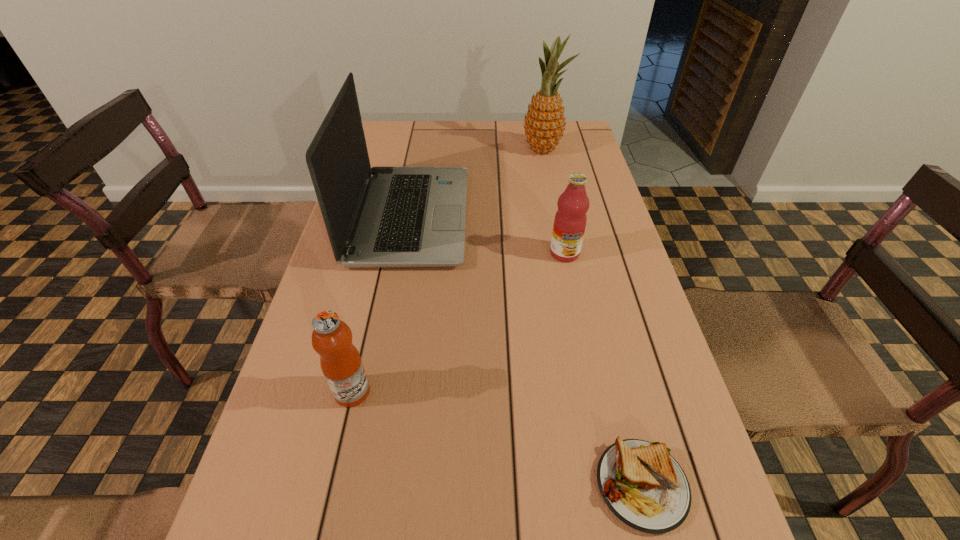
What are the coordinates of `free location at the left edge of the desktop` in the screenshot? It's located at (362, 291).

The width and height of the screenshot is (960, 540). Find the location of `free space at the right edge`. free space at the right edge is located at coordinates (587, 159).

At what (x,y) coordinates should I click in order to perform the action: click on vacant space at the far left corner. Please return your answer as a coordinate pair (x, y). Looking at the image, I should click on (419, 142).

Where is `vacant space at the far right corner of the desktop`? vacant space at the far right corner of the desktop is located at coordinates (579, 143).

Find the location of `empty location between the nearer fruit juice and the shortest object`. empty location between the nearer fruit juice and the shortest object is located at coordinates (497, 438).

Where is `vacant area between the right fruit juice and the shortest object`? vacant area between the right fruit juice and the shortest object is located at coordinates (603, 369).

What are the coordinates of `free space between the left fruit juice and the right fruit juice` in the screenshot? It's located at (459, 322).

Image resolution: width=960 pixels, height=540 pixels. Identify the location of blank region between the right fruit juice and the pineapple. (554, 201).

Where is `vacant area between the fourth shortest object and the nearer fruit juice`? The height and width of the screenshot is (540, 960). vacant area between the fourth shortest object and the nearer fruit juice is located at coordinates (381, 304).

Find the location of a particular element. Image resolution: width=960 pixels, height=540 pixels. vacant area that lies between the sandwich and the right fruit juice is located at coordinates (603, 369).